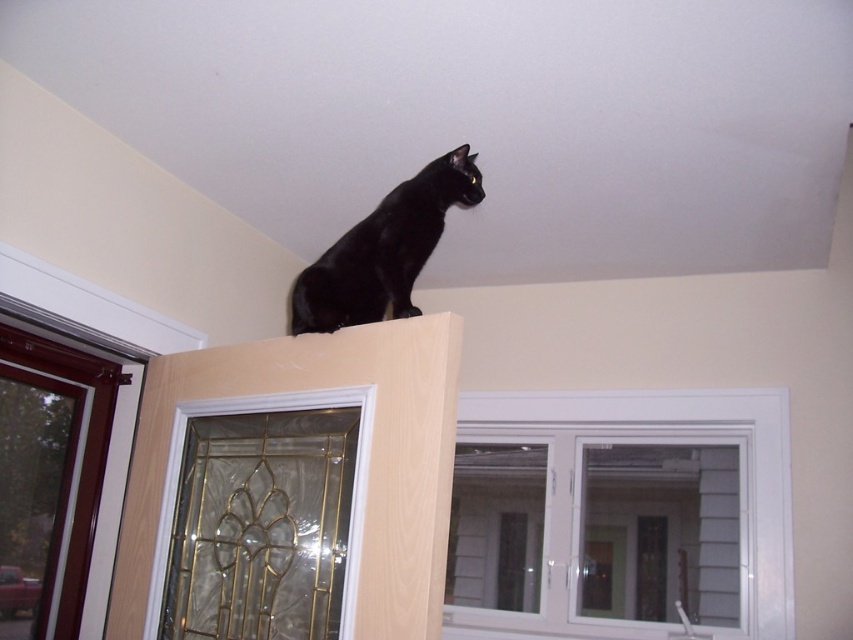
Question: Is white plastic window at upper center positioned behind matte black cat at upper center?

Choices:
 (A) no
 (B) yes

Answer: (B)

Question: Which object appears farthest from the camera in this image?

Choices:
 (A) clear glass door at upper center
 (B) white plastic window at upper center
 (C) matte black cat at upper center

Answer: (B)

Question: Considering the real-world distances, which object is closest to the white plastic window at upper center?

Choices:
 (A) clear glass door at upper center
 (B) matte black cat at upper center

Answer: (B)

Question: Can you confirm if matte black cat at upper center is smaller than clear glass door at upper center?

Choices:
 (A) no
 (B) yes

Answer: (B)

Question: Which point is farther from the camera taking this photo?

Choices:
 (A) (430, 243)
 (B) (743, 540)
 (C) (157, 536)

Answer: (B)

Question: Is matte black cat at upper center wider than clear glass door at upper center?

Choices:
 (A) yes
 (B) no

Answer: (B)